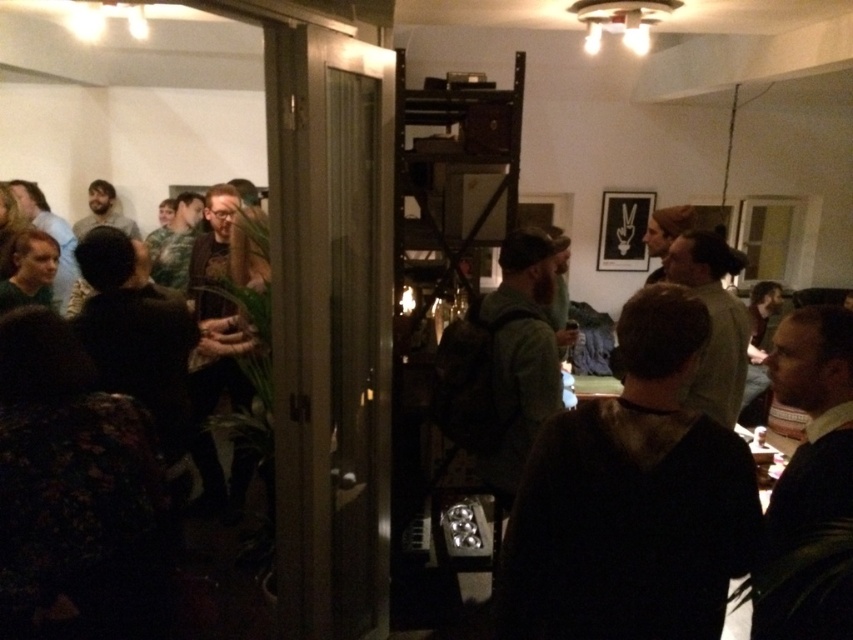
You are at a party and see two dark brown items of clothing. The dark brown hoodie at center and the dark brown leather jacket at left. Which one is positioned more to the right?

The dark brown hoodie at center is positioned more to the right than the dark brown leather jacket at left.

From the picture: You are at a party and want to borrow a coat from the dark brown hoodie at center and dark brown leather jacket at left. Which one is more likely to have a larger size?

The dark brown leather jacket at left is larger in size compared to the dark brown hoodie at center.

You are trying to decide which item to take from the scene to wear. The dark brown hoodie at center and the dark brown leather jacket at left are both available. Based on their sizes, which one might you choose if you prefer a looser fit?

The dark brown hoodie at center might be wider than the dark brown leather jacket at left, so if you prefer a looser fit, you should choose the dark brown hoodie at center.